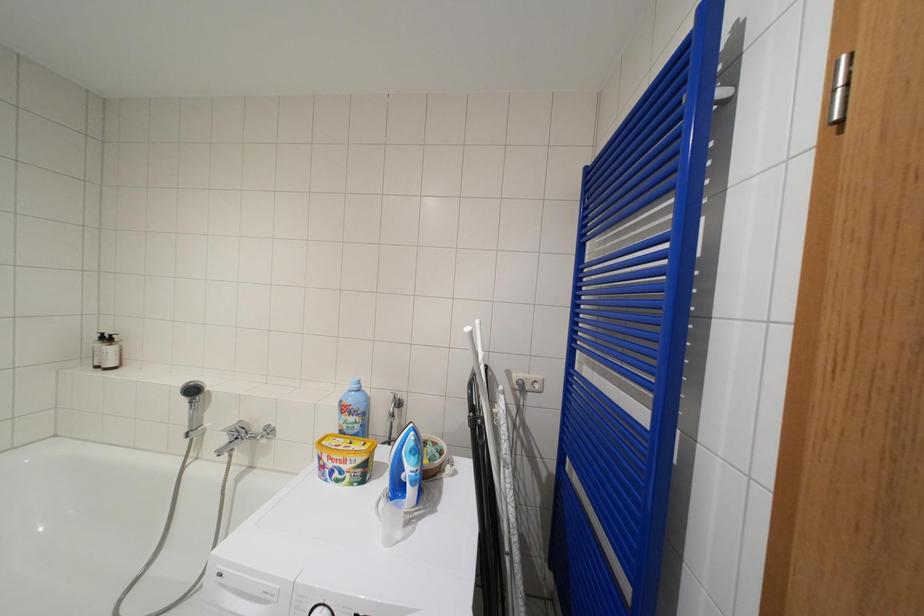
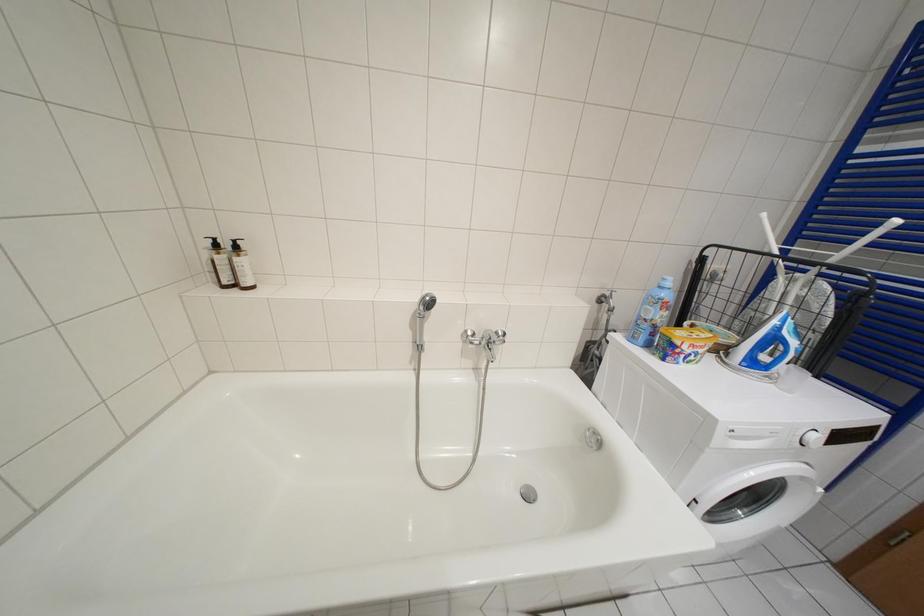
Question: In a continuous first-person perspective shot, in which direction is the camera moving?

Choices:
 (A) Left
 (B) Right
 (C) Forward
 (D) Backward

Answer: (A)